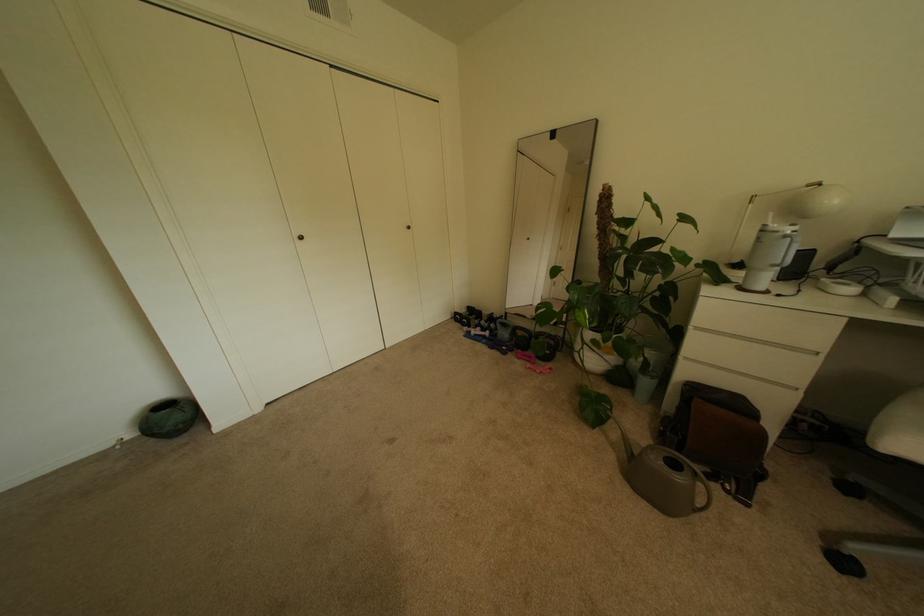
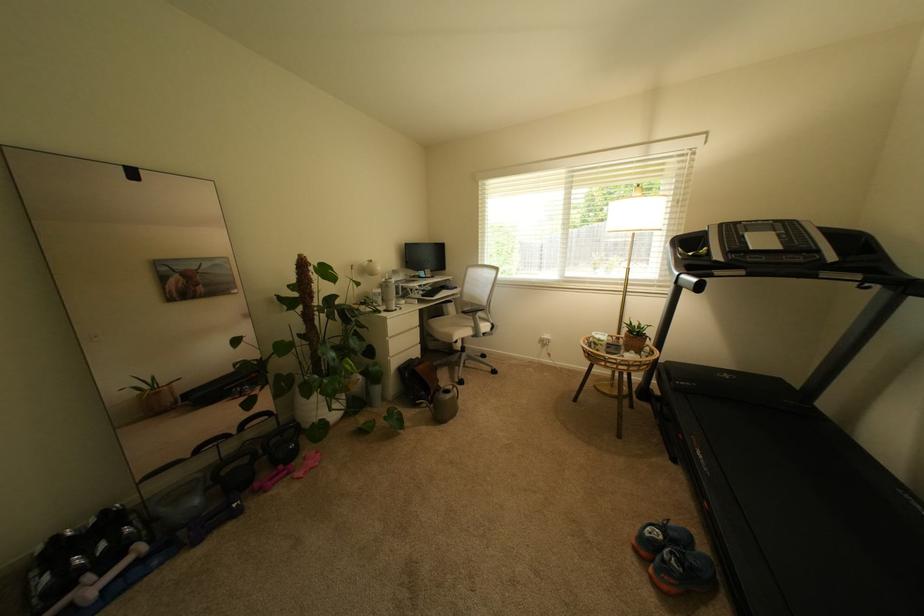
Locate, in the second image, the point that corresponds to (490,333) in the first image.

(111, 573)